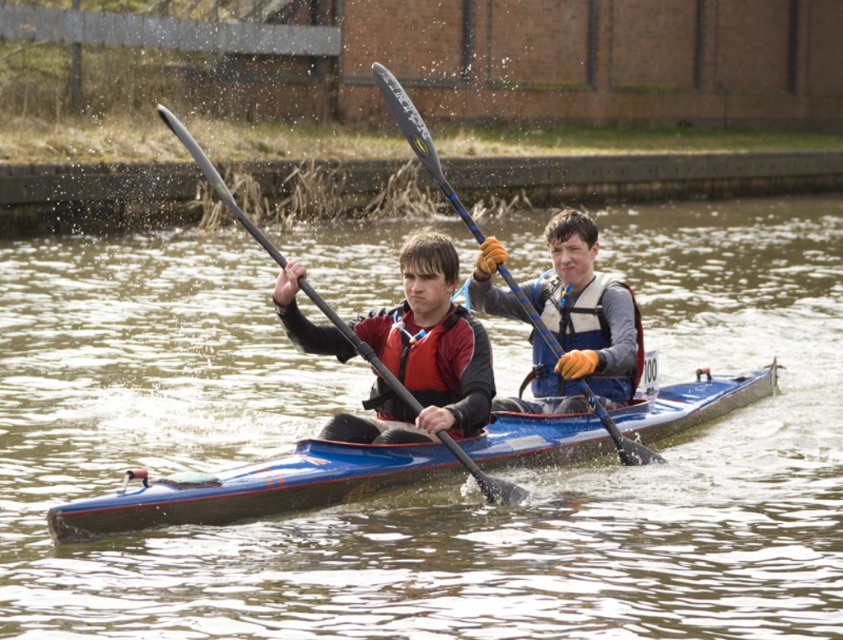
Who is higher up, brown murky water at center or matte blue kayak at center?

Positioned higher is brown murky water at center.

Who is more distant from viewer, (750, 276) or (623, 308)?

Positioned behind is point (750, 276).

You are a GUI agent. You are given a task and a screenshot of the screen. Output one action in this format:
    pyautogui.click(x=<x>, y=<y>)
    Task: Click on the brown murky water at center
    The image size is (843, 640).
    Given the screenshot: What is the action you would take?
    pyautogui.click(x=428, y=483)

Which of these two, matte red life jacket at center or gray fabric life jacket at center, stands taller?

Standing taller between the two is gray fabric life jacket at center.

Is point (416, 394) closer to camera compared to point (560, 392)?

Yes, it is in front of point (560, 392).

Identify the location of matte red life jacket at center. This screenshot has height=640, width=843. (436, 360).

Looking at this image, is matte red life jacket at center shorter than matte black paddle at left?

Yes.

How much distance is there between matte red life jacket at center and matte black paddle at left?

They are 21.38 inches apart.

Measure the distance between point (x=427, y=376) and camera.

A distance of 17.18 meters exists between point (x=427, y=376) and camera.

You are a GUI agent. You are given a task and a screenshot of the screen. Output one action in this format:
    pyautogui.click(x=<x>, y=<y>)
    Task: Click on the matte red life jacket at center
    The image size is (843, 640).
    Given the screenshot: What is the action you would take?
    pyautogui.click(x=436, y=360)